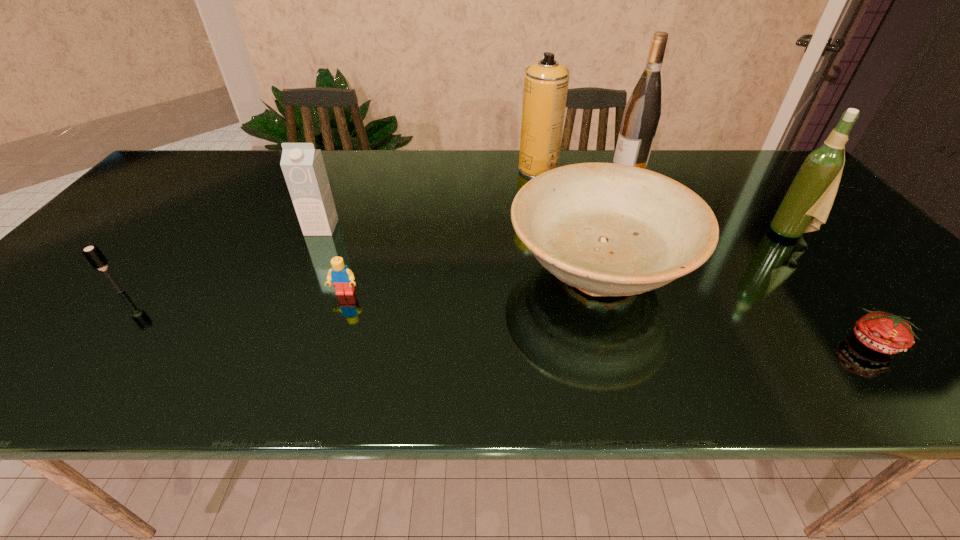
This screenshot has width=960, height=540. In order to click on vacant space at the far edge of the desktop in this screenshot , I will do `click(438, 164)`.

Identify the location of vacant space at the near edge of the desktop. Image resolution: width=960 pixels, height=540 pixels. (479, 368).

In the image, there is a desktop. Identify the location of vacant space at the left edge. Image resolution: width=960 pixels, height=540 pixels. (108, 229).

Locate an element on the screen. The height and width of the screenshot is (540, 960). vacant position at the far left corner of the desktop is located at coordinates (181, 157).

At what (x,y) coordinates should I click in order to perform the action: click on vacant region between the second shortest object and the dish. Please return your answer as a coordinate pair (x, y). Looking at the image, I should click on (471, 282).

Locate an element on the screen. free space between the aerosol can and the second object from left to right is located at coordinates (430, 198).

Locate an element on the screen. This screenshot has width=960, height=540. free space between the second object from left to right and the sixth tallest object is located at coordinates (221, 259).

Find the location of a particular element. This screenshot has width=960, height=540. vacant point located between the taller wine bottle and the leftmost object is located at coordinates (374, 230).

Where is `vacant space that is in between the aerosol can and the seventh tallest object`? vacant space that is in between the aerosol can and the seventh tallest object is located at coordinates (442, 231).

This screenshot has width=960, height=540. I want to click on free space between the fifth tallest object and the carton, so click(460, 249).